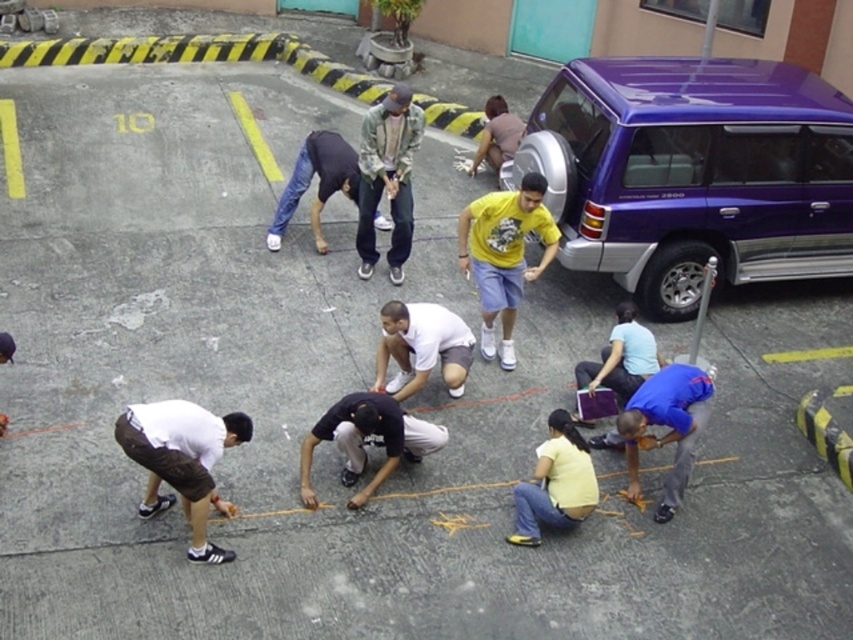
You are a photographer trying to capture a candid shot of the light blue shirt at center without including the white matte shorts at lower left in the frame. Based on their positions, is this possible?

The white matte shorts at lower left is in front of light blue shirt at center, so it would block the view. Therefore, capturing the light blue shirt at center without the white matte shorts at lower left in the frame is not possible.

You are a photographer trying to capture a candid shot of the brown cotton shirt at center without including the white matte shorts at lower left in the frame. Based on their positions, is this possible?

The white matte shorts at lower left is positioned under brown cotton shirt at center, so it is likely that the shorts will be in the frame if the shirt is centered. To avoid capturing the shorts, the photographer should adjust the camera angle to exclude the lower portion where the shorts are located.

You are a photographer positioned at the edge of the parking lot. You need to capture a photo that includes both the white matte shorts at lower left and the brown cotton shirt at center. Based on their sizes, which object should you focus on first to ensure both are in frame?

The white matte shorts at lower left is larger in size compared to the brown cotton shirt at center. To ensure both are in frame, focus on the white matte shorts at lower left first as it requires more space.